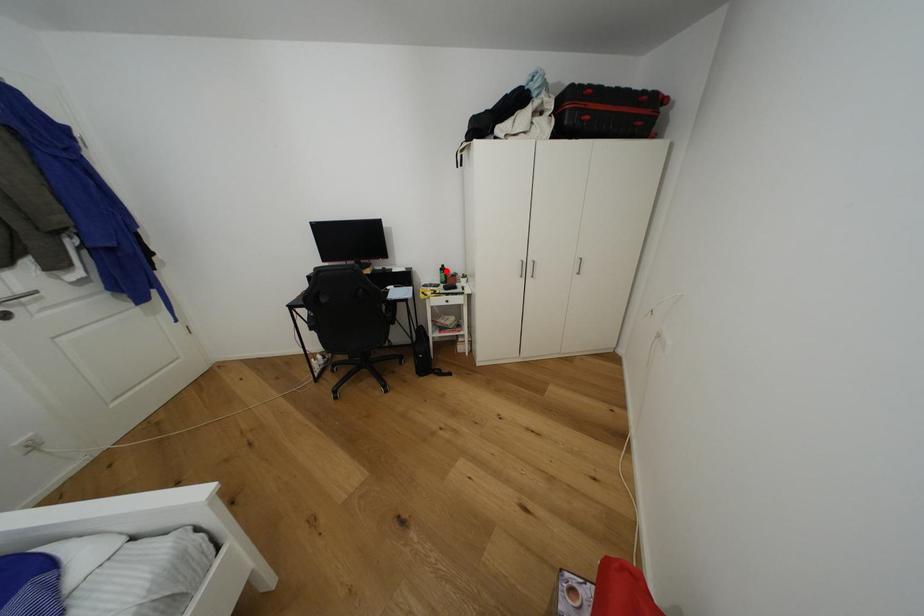
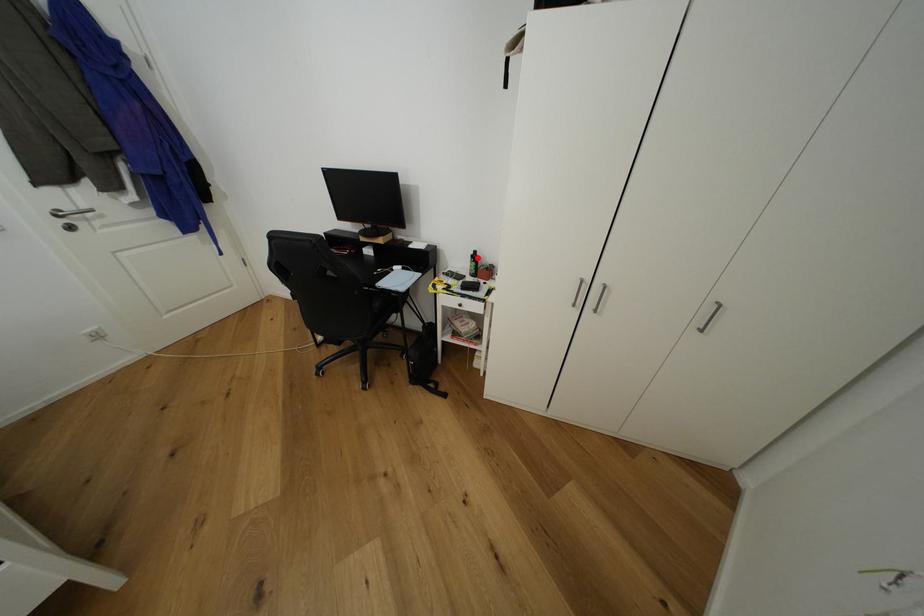
I am providing you with two images of the same scene from different viewpoints. A red point is marked on the first image and another point is marked on the second image. Are the points marked in image1 and image2 representing the same 3D position?

Yes